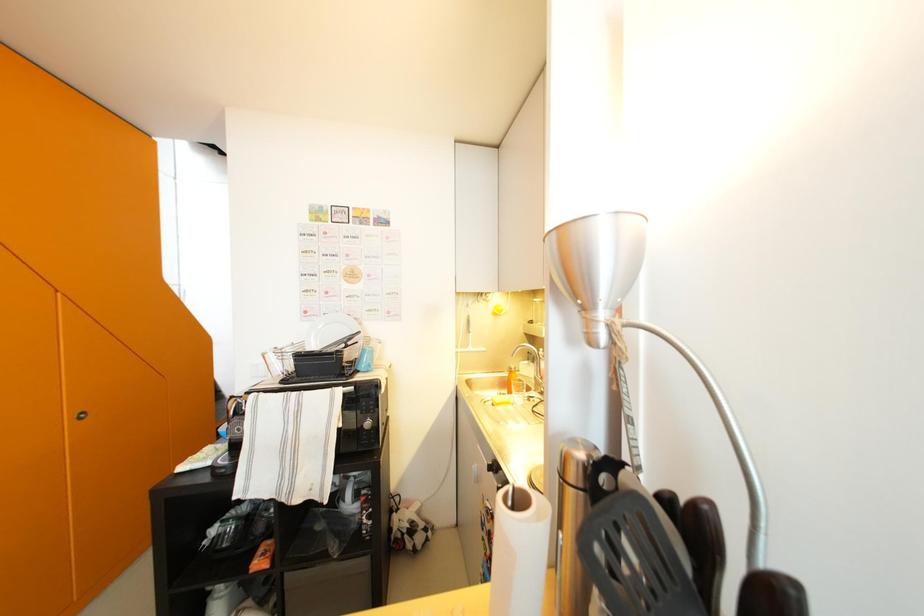
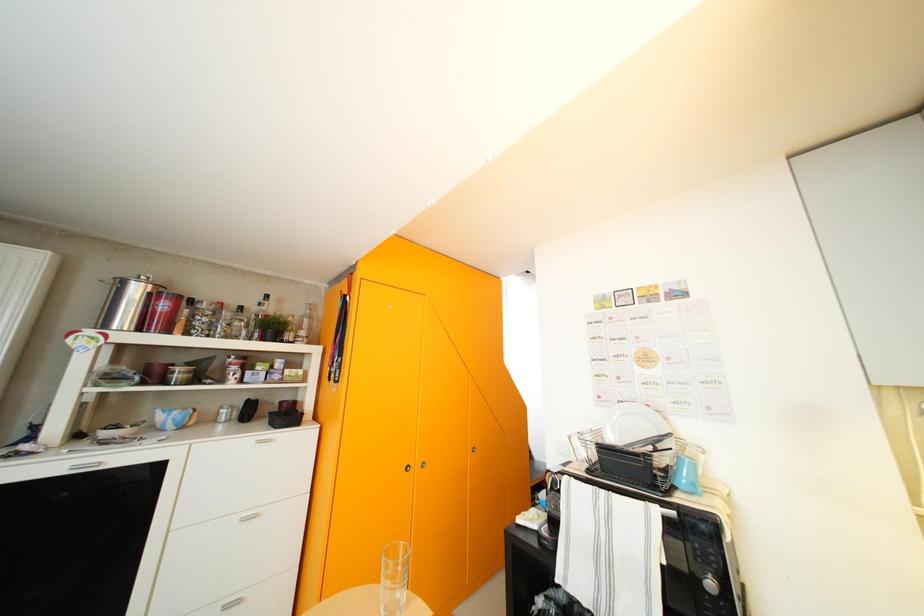
Question: The camera is either moving clockwise (left) or counter-clockwise (right) around the object. The first image is from the beginning of the video and the second image is from the end. Is the camera moving left or right when shooting the video?

Choices:
 (A) Left
 (B) Right

Answer: (B)